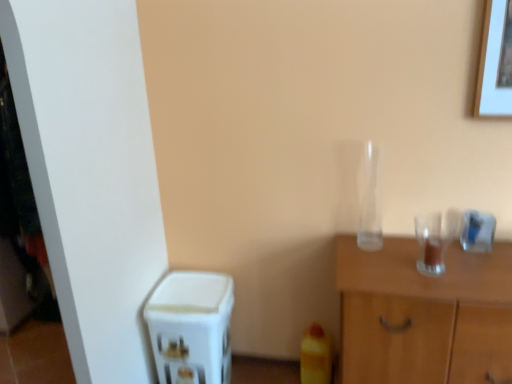
Question: Is white plastic water dispenser at lower left inside or outside of transparent glass vase at center-right?

Choices:
 (A) outside
 (B) inside

Answer: (A)

Question: Considering their positions, is white plastic water dispenser at lower left located in front of or behind transparent glass vase at center-right?

Choices:
 (A) front
 (B) behind

Answer: (B)

Question: Estimate the real-world distances between objects in this image. Which object is closer to the transparent glass cabinet at right?

Choices:
 (A) white plastic water dispenser at lower left
 (B) transparent glass vase at center-right

Answer: (B)

Question: Which of these objects is positioned closest to the transparent glass cabinet at right?

Choices:
 (A) transparent glass vase at center-right
 (B) white plastic water dispenser at lower left

Answer: (A)